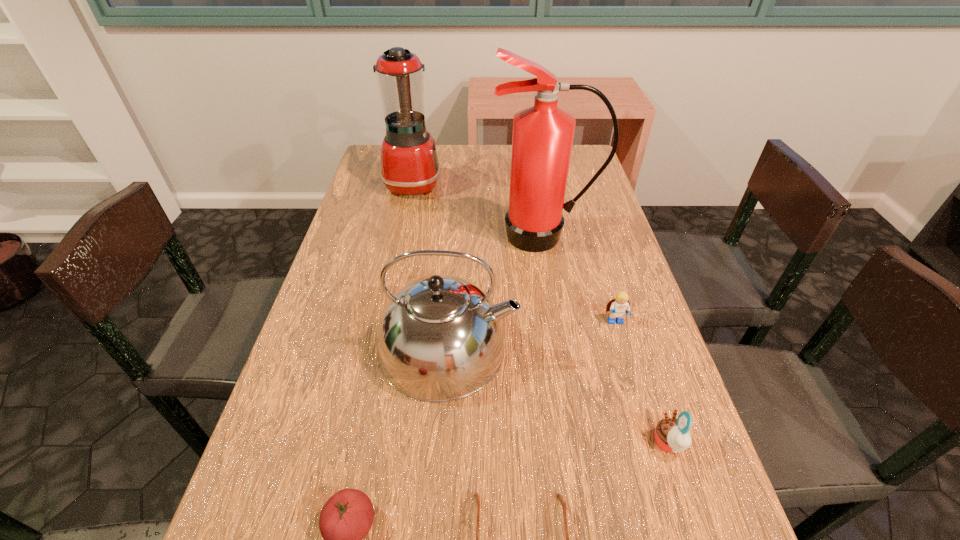
The height and width of the screenshot is (540, 960). I want to click on object identified as the closest to the food processor, so click(x=542, y=138).

Identify which object is located as the second nearest to the food processor. Please provide its 2D coordinates. Your answer should be formatted as a tuple, i.e. [(x, y)], where the tuple contains the x and y coordinates of a point satisfying the conditions above.

[(440, 338)]